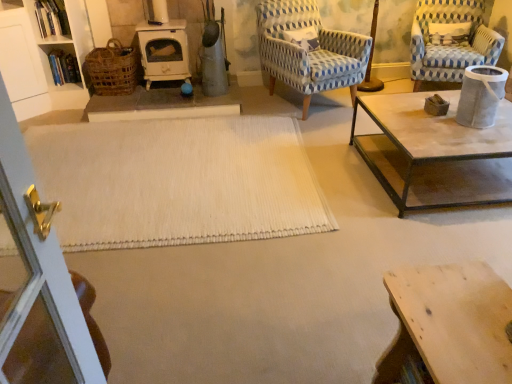
This screenshot has width=512, height=384. Identify the location of vacant area on top of white woven rug at center (from a real-world perspective). (156, 163).